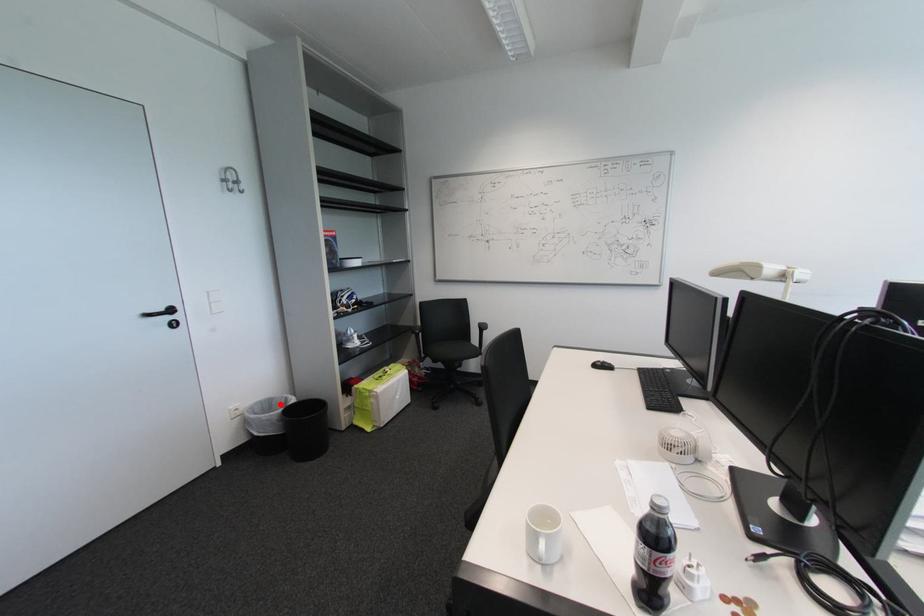
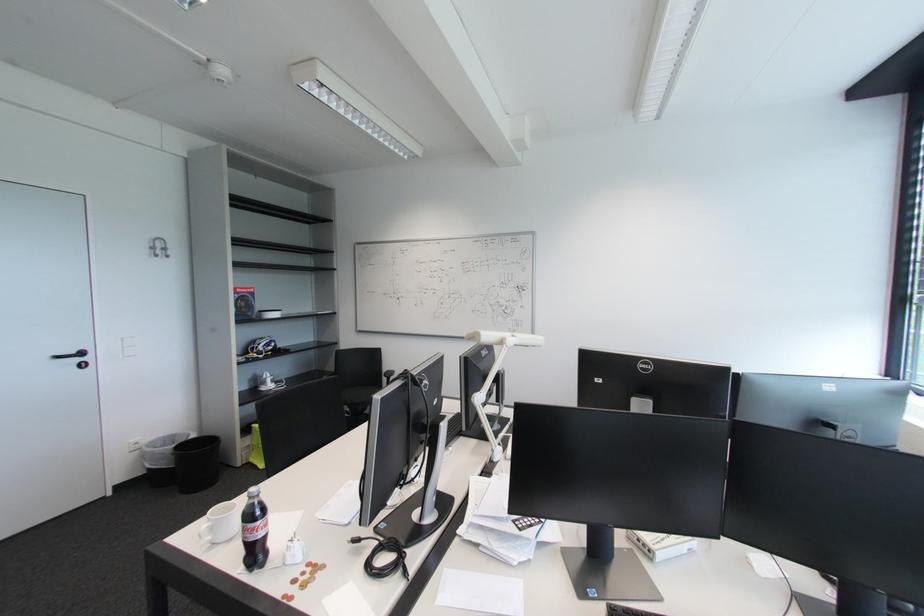
Question: I am providing you with two images of the same scene from different viewpoints. Image1 has a red point marked. In image2, the corresponding 3D location appears at what relative position? Reply with the corresponding letter.

Choices:
 (A) Closer
 (B) Farther

Answer: (B)